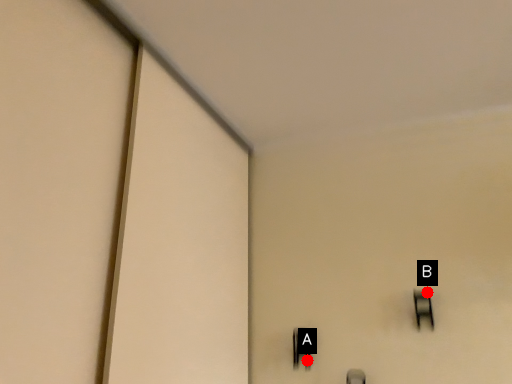
Question: Two points are circled on the image, labeled by A and B beside each circle. Which point is closer to the camera?

Choices:
 (A) A is closer
 (B) B is closer

Answer: (B)